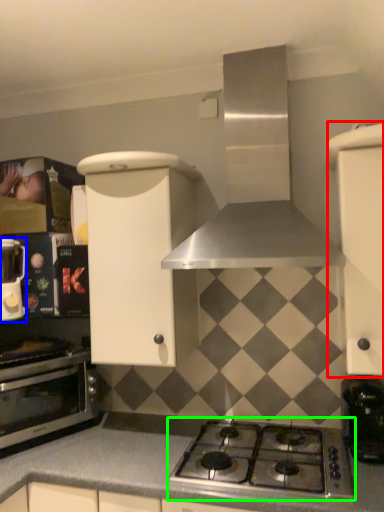
Question: Which object is positioned closest to cabinetry (highlighted by a red box)? Select from kitchen appliance (highlighted by a blue box) and gas stove (highlighted by a green box).

Choices:
 (A) kitchen appliance
 (B) gas stove

Answer: (B)